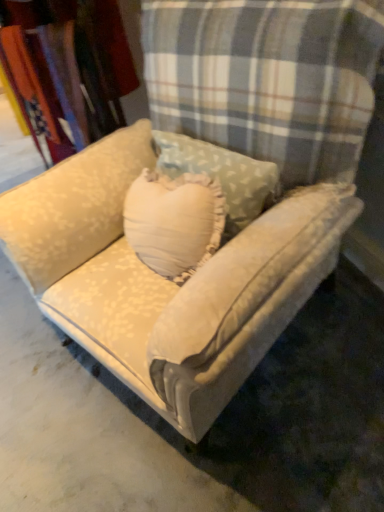
Question: From the image's perspective, is velvet beige couch at center located above or below cream floral fabric at upper left?

Choices:
 (A) above
 (B) below

Answer: (B)

Question: Is point (329, 193) positioned closer to the camera than point (82, 64)?

Choices:
 (A) closer
 (B) farther

Answer: (A)

Question: Looking at their shapes, would you say velvet beige couch at center is wider or thinner than cream floral fabric at upper left?

Choices:
 (A) thin
 (B) wide

Answer: (B)

Question: Is cream floral fabric at upper left wider or thinner than velvet beige couch at center?

Choices:
 (A) thin
 (B) wide

Answer: (A)

Question: Considering their positions, is cream floral fabric at upper left located in front of or behind velvet beige couch at center?

Choices:
 (A) behind
 (B) front

Answer: (A)

Question: From the image's perspective, is cream floral fabric at upper left above or below velvet beige couch at center?

Choices:
 (A) below
 (B) above

Answer: (B)

Question: Based on their positions, is cream floral fabric at upper left located to the left or right of velvet beige couch at center?

Choices:
 (A) left
 (B) right

Answer: (A)